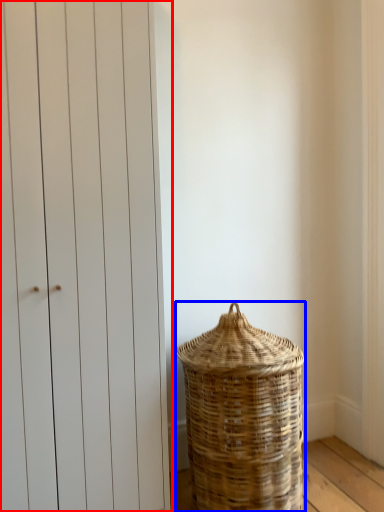
Question: Which point is further to the camera, door (highlighted by a red box) or basket (highlighted by a blue box)?

Choices:
 (A) door
 (B) basket

Answer: (B)